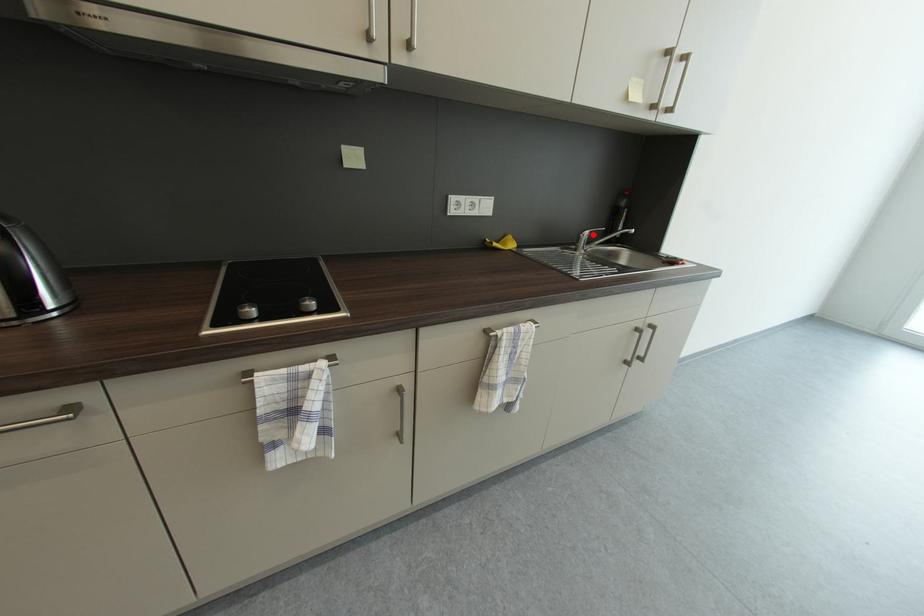
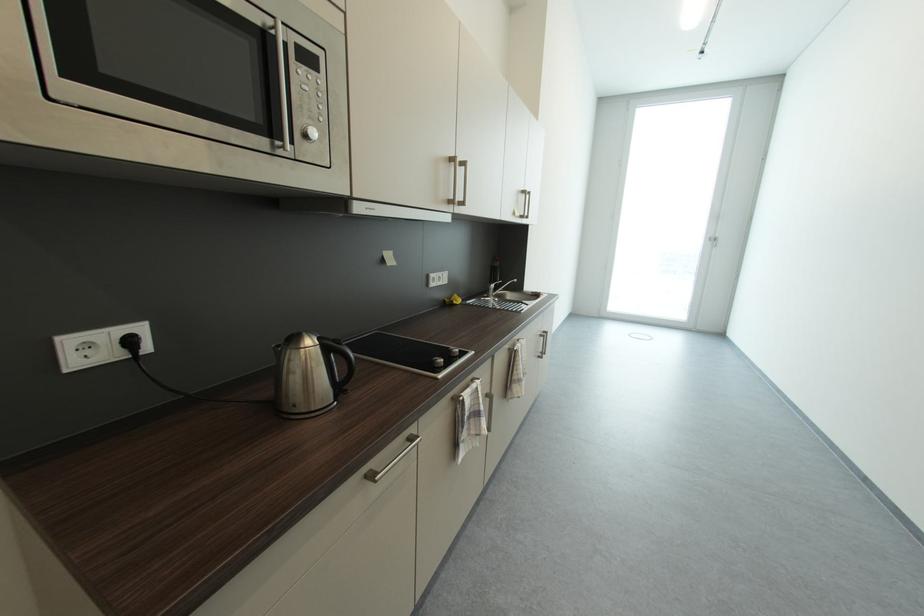
Locate, in the second image, the point that corresponds to the highlighted location in the first image.

(499, 286)